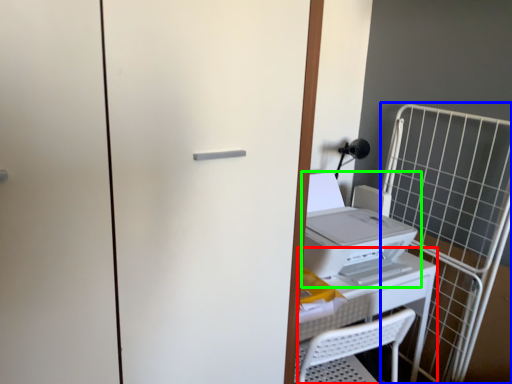
Question: Considering the real-world distances, which object is farthest from table (highlighted by a red box)? cage (highlighted by a blue box) or home appliance (highlighted by a green box)?

Choices:
 (A) cage
 (B) home appliance

Answer: (A)